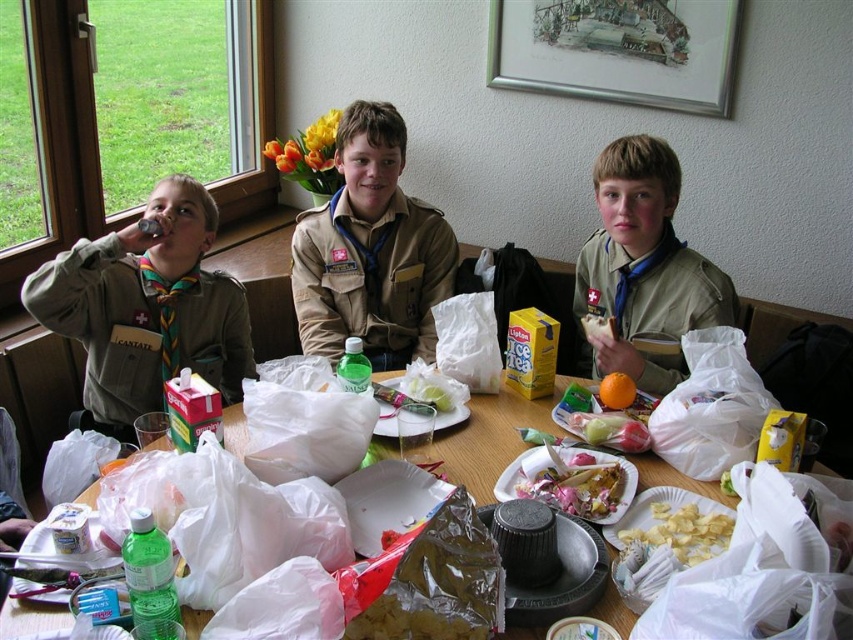
Which is in front, point (318, 298) or point (619, 349)?

Point (619, 349)

Can you confirm if brown uniform at center is shorter than matte khaki uniform at center?

No, brown uniform at center is not shorter than matte khaki uniform at center.

Who is more distant from viewer, (x=383, y=348) or (x=587, y=291)?

The point (x=383, y=348) is behind.

I want to click on brown uniform at center, so click(x=370, y=250).

Identify the location of shiny metallic tray at center. (572, 481).

Locate an element on the screen. This screenshot has width=853, height=640. shiny metallic tray at center is located at coordinates (572, 481).

Who is taller, matte green uniform at left or brown uniform at center?

brown uniform at center is taller.

Who is more distant from viewer, (143,321) or (305,344)?

The point (305,344) is more distant.

Identify the location of matte green uniform at left. (148, 307).